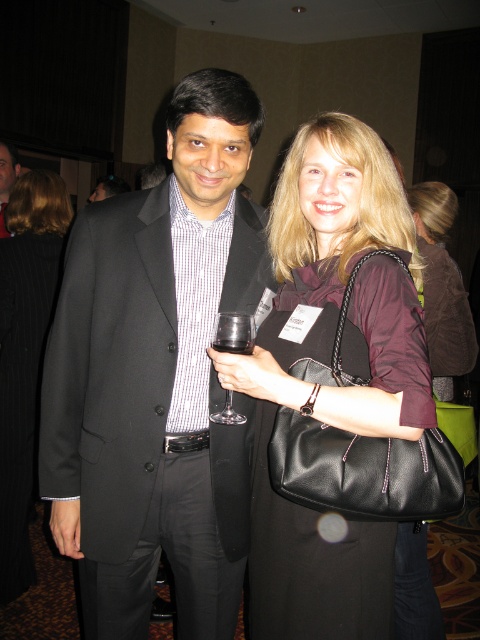
Is leather handbag at center further to the viewer compared to transparent glass at center?

Yes.

Looking at this image, is leather handbag at center to the left of transparent glass at center from the viewer's perspective?

Incorrect, leather handbag at center is not on the left side of transparent glass at center.

Is point (444, 387) positioned before point (252, 337)?

That is False.

At what (x,y) coordinates should I click in order to perform the action: click on leather handbag at center. Please return your answer as a coordinate pair (x, y). The image size is (480, 640). Looking at the image, I should click on (442, 288).

I want to click on black matte suit at center, so click(156, 378).

Can you confirm if black matte suit at center is wider than maroon leather jacket at center?

Yes.

What do you see at coordinates (156, 378) in the screenshot? This screenshot has height=640, width=480. I see `black matte suit at center` at bounding box center [156, 378].

Where is `black matte suit at center`? The image size is (480, 640). black matte suit at center is located at coordinates (156, 378).

Is the position of maroon leather jacket at center less distant than that of clear glass wine at center?

No, maroon leather jacket at center is behind clear glass wine at center.

Is maroon leather jacket at center taller than clear glass wine at center?

Yes.

This screenshot has width=480, height=640. Find the location of `maroon leather jacket at center`. maroon leather jacket at center is located at coordinates (442, 288).

You are a GUI agent. You are given a task and a screenshot of the screen. Output one action in this format:
    pyautogui.click(x=<x>, y=<y>)
    Task: Click on the maroon leather jacket at center
    
    Given the screenshot: What is the action you would take?
    pyautogui.click(x=442, y=288)